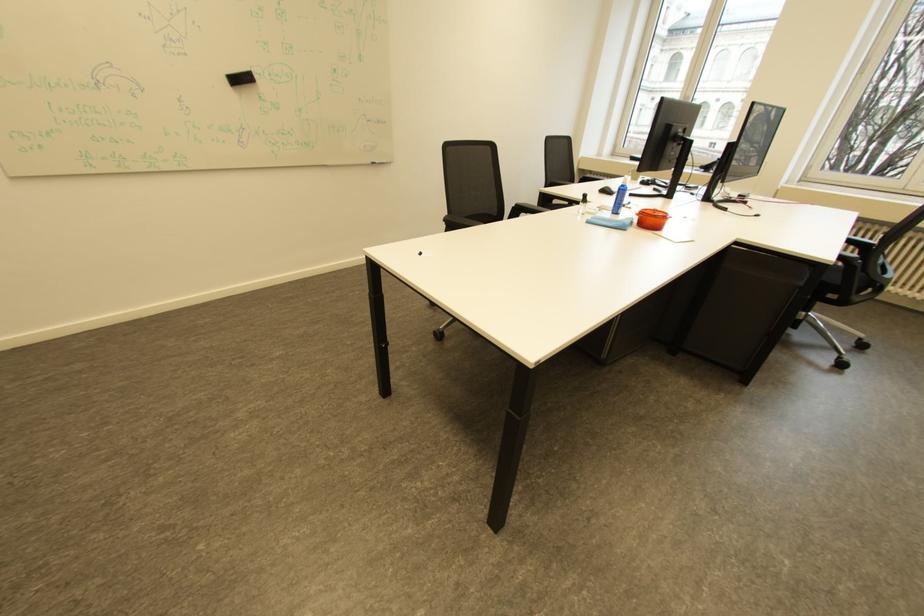
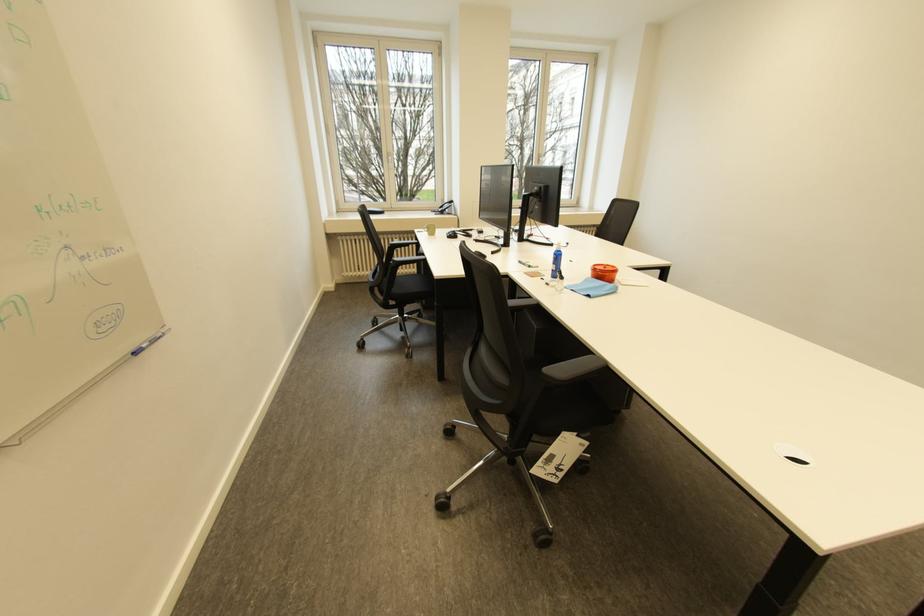
The point at [623,211] is marked in the first image. Where is the corresponding point in the second image?

(562, 276)